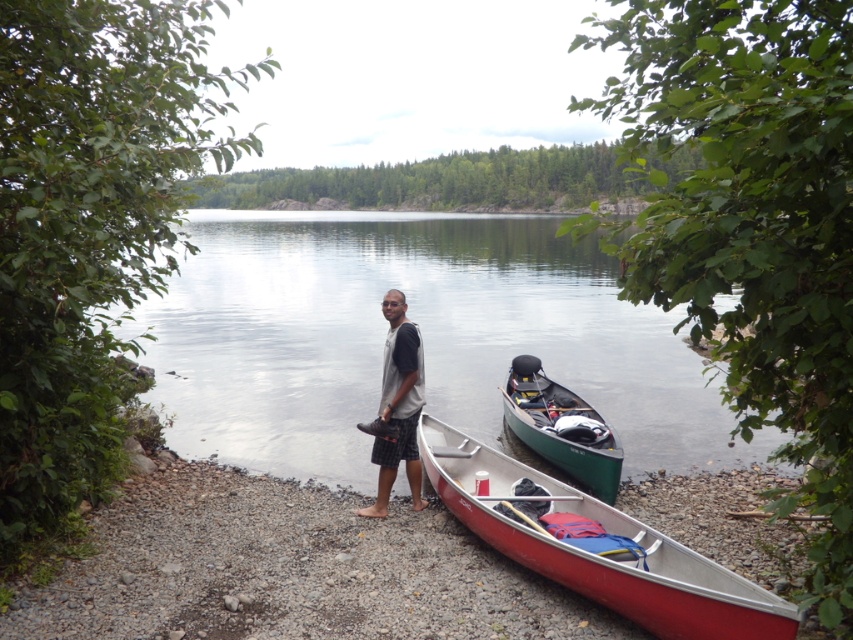
Is red aluminum canoe at lower center smaller than green matte canoe at center?

No, red aluminum canoe at lower center is not smaller than green matte canoe at center.

Can you confirm if red aluminum canoe at lower center is positioned below green matte canoe at center?

Indeed, red aluminum canoe at lower center is positioned under green matte canoe at center.

At what (x,y) coordinates should I click in order to perform the action: click on red aluminum canoe at lower center. Please return your answer as a coordinate pair (x, y). Looking at the image, I should click on (599, 548).

This screenshot has height=640, width=853. In order to click on red aluminum canoe at lower center in this screenshot , I will do `click(599, 548)`.

Is red aluminum canoe at lower center shorter than gray fabric shirt at center?

Yes.

Does point (469, 461) come closer to viewer compared to point (407, 328)?

That is False.

Identify the location of red aluminum canoe at lower center. (599, 548).

Looking at this image, is smooth water at center closer to camera compared to red aluminum canoe at lower center?

No, it is not.

Is point (637, 397) behind point (740, 627)?

That is True.

Where is `smooth water at center`? smooth water at center is located at coordinates (422, 336).